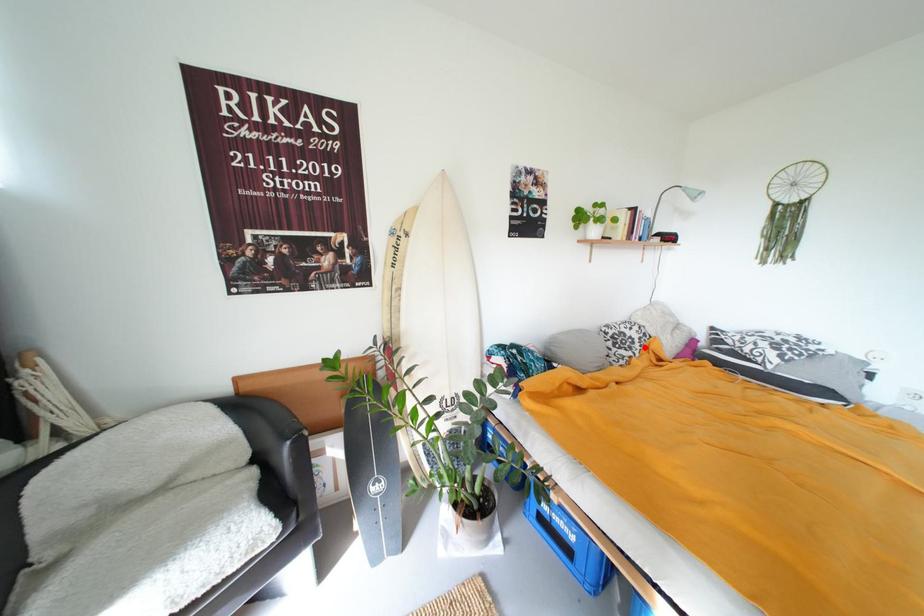
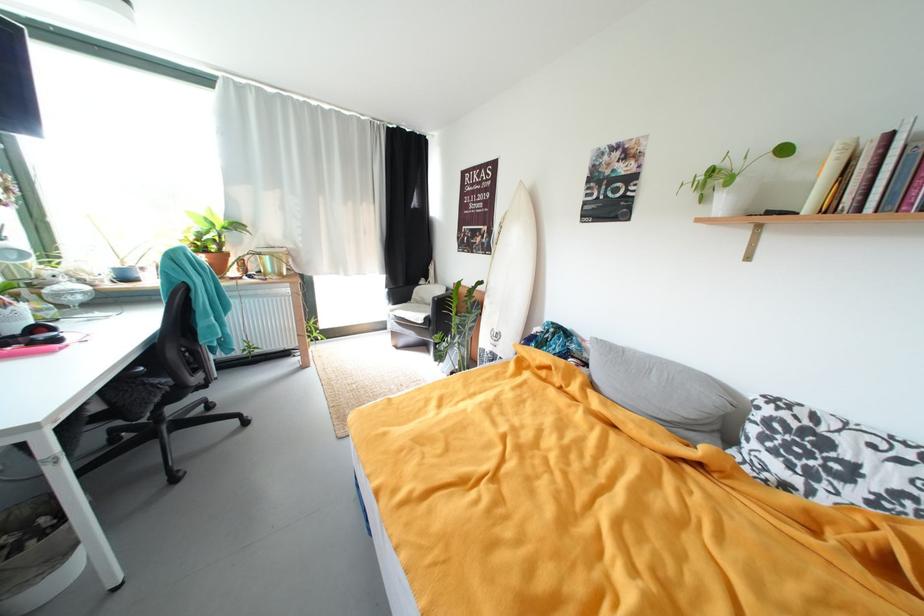
The point at the highlighted location is marked in the first image. Where is the corresponding point in the second image?

(861, 493)